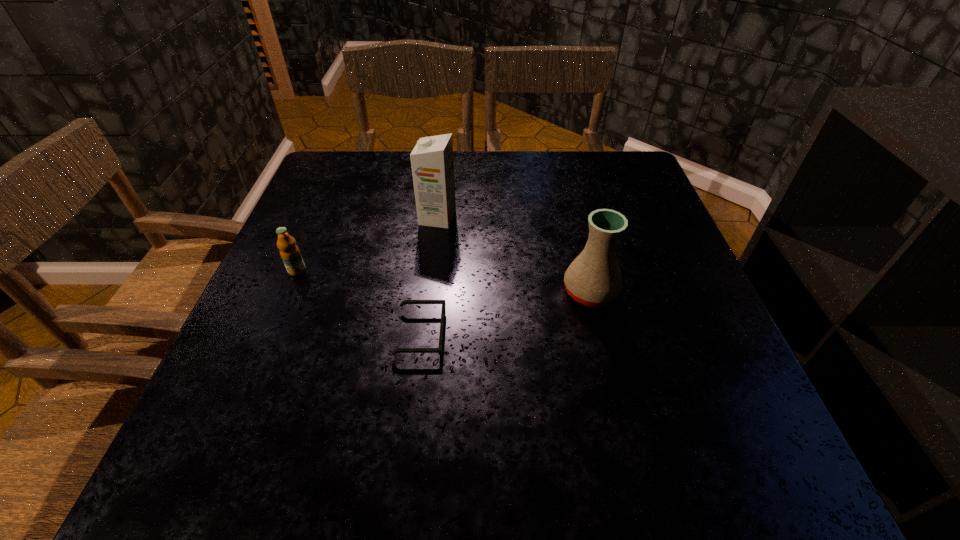
Find the location of a particular element. Image resolution: width=960 pixels, height=540 pixels. vacant space that satisfies the following two spatial constraints: 1. on the front side of the farthest object; 2. on the right side of the pottery is located at coordinates (429, 292).

Locate an element on the screen. The height and width of the screenshot is (540, 960). free space that satisfies the following two spatial constraints: 1. on the label of the leftmost object; 2. on the right side of the rightmost object is located at coordinates (288, 292).

Locate an element on the screen. vacant space that satisfies the following two spatial constraints: 1. on the label of the pottery; 2. on the right side of the orange juice is located at coordinates point(288,292).